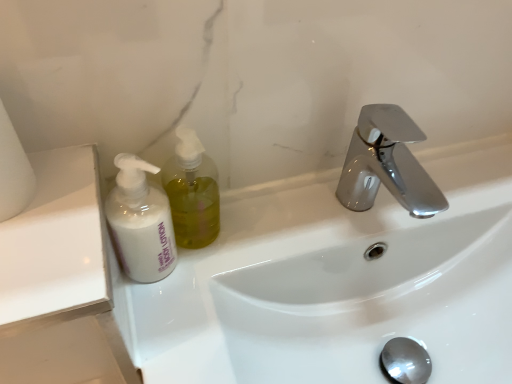
This screenshot has height=384, width=512. What do you see at coordinates (192, 192) in the screenshot?
I see `translucent yellow liquid at left` at bounding box center [192, 192].

I want to click on white matte toilet paper at left, so click(13, 171).

At what (x,y) coordinates should I click in order to perform the action: click on translucent yellow liquid at left. Please return your answer as a coordinate pair (x, y). The height and width of the screenshot is (384, 512). Looking at the image, I should click on (192, 192).

Is white glossy sink at center behind white matte toilet paper at left?

Yes, white glossy sink at center is further from the camera.

Is white glossy sink at center completely or partially outside of white matte toilet paper at left?

white glossy sink at center lies outside white matte toilet paper at left's area.

Are white glossy sink at center and white matte toilet paper at left far apart?

They are positioned close to each other.

From a real-world perspective, who is located lower, white glossy sink at center or white matte toilet paper at left?

In real-world perspective, white glossy sink at center is lower.

Which is in front, point (13, 145) or point (172, 252)?

The point (13, 145) is in front.

Is white matte toilet paper at left inside or outside of white matte lotion at left?

white matte toilet paper at left is spatially situated outside white matte lotion at left.

From the image's perspective, would you say white matte toilet paper at left is positioned over white matte lotion at left?

Yes, from the image's perspective, white matte toilet paper at left is over white matte lotion at left.

The width and height of the screenshot is (512, 384). I want to click on cleaning product on the right of white matte toilet paper at left, so click(141, 221).

Which is behind, point (294, 282) or point (122, 178)?

The point (294, 282) is behind.

Looking at their sizes, would you say white glossy sink at center is wider or thinner than white matte lotion at left?

In the image, white glossy sink at center appears to be wider than white matte lotion at left.

Is white glossy sink at center turned away from white matte lotion at left?

No, white glossy sink at center's orientation is not away from white matte lotion at left.

Between white glossy sink at center and white matte lotion at left, which one is positioned in front?

Positioned in front is white glossy sink at center.

Can you confirm if translucent yellow liquid at left is taller than white matte toilet paper at left?

Correct, translucent yellow liquid at left is much taller as white matte toilet paper at left.

Find the location of `toilet paper that is above the translucent yellow liquid at left (from a real-world perspective)`. toilet paper that is above the translucent yellow liquid at left (from a real-world perspective) is located at coordinates (13, 171).

Can you confirm if translucent yellow liquid at left is bigger than white matte toilet paper at left?

Incorrect, translucent yellow liquid at left is not larger than white matte toilet paper at left.

From a real-world perspective, is translucent yellow liquid at left on top of white matte toilet paper at left?

No, from a real-world perspective, translucent yellow liquid at left is not on top of white matte toilet paper at left.

Is the depth of white matte toilet paper at left greater than that of white glossy sink at center?

No.

In terms of width, does white matte toilet paper at left look wider or thinner when compared to white glossy sink at center?

In the image, white matte toilet paper at left appears to be more narrow than white glossy sink at center.

Who is smaller, white matte toilet paper at left or white glossy sink at center?

With smaller size is white matte toilet paper at left.

From a real-world perspective, is white matte toilet paper at left physically located above or below white glossy sink at center?

In terms of real-world spatial position, white matte toilet paper at left is above white glossy sink at center.

From a real-world perspective, which is physically above, translucent yellow liquid at left or white glossy sink at center?

From a 3D spatial view, translucent yellow liquid at left is above.

Is white glossy sink at center at the back of translucent yellow liquid at left?

translucent yellow liquid at left does not have its back to white glossy sink at center.

Which is more distant, (175, 202) or (333, 176)?

The point (333, 176) is farther.

This screenshot has height=384, width=512. I want to click on sink below the translucent yellow liquid at left (from the image's perspective), so click(340, 279).

Is white matte lotion at left to the left of translucent yellow liquid at left from the viewer's perspective?

Yes, white matte lotion at left is to the left of translucent yellow liquid at left.

Where is `soap dispenser behind the white matte lotion at left`? soap dispenser behind the white matte lotion at left is located at coordinates (192, 192).

How many degrees apart are the facing directions of white matte lotion at left and translucent yellow liquid at left?

2.34 degrees.

Is white matte lotion at left facing towards translucent yellow liquid at left?

No, white matte lotion at left is not aimed at translucent yellow liquid at left.

I want to click on toilet paper that is above the white glossy sink at center (from the image's perspective), so click(x=13, y=171).

This screenshot has width=512, height=384. I want to click on toilet paper on the left of white matte lotion at left, so click(x=13, y=171).

Based on their spatial positions, is white glossy sink at center or white matte toilet paper at left further from white matte lotion at left?

white glossy sink at center lies further to white matte lotion at left than the other object.

From the image, which object appears to be nearer to translucent yellow liquid at left, white glossy sink at center or white matte lotion at left?

white matte lotion at left is closer to translucent yellow liquid at left.

Considering their positions, is white matte toilet paper at left positioned closer to white glossy sink at center than white matte lotion at left?

Based on the image, white matte lotion at left appears to be nearer to white glossy sink at center.

Looking at the image, which one is located further to white glossy sink at center, translucent yellow liquid at left or white matte lotion at left?

The object further to white glossy sink at center is white matte lotion at left.

Looking at this image, looking at the image, which one is located closer to white matte toilet paper at left, white matte lotion at left or white glossy sink at center?

white matte lotion at left is closer to white matte toilet paper at left.

Estimate the real-world distances between objects in this image. Which object is closer to white matte toilet paper at left, white matte lotion at left or translucent yellow liquid at left?

white matte lotion at left is closer to white matte toilet paper at left.

Considering their positions, is translucent yellow liquid at left positioned further to white matte toilet paper at left than white matte lotion at left?

translucent yellow liquid at left is further to white matte toilet paper at left.

Considering their positions, is white matte toilet paper at left positioned further to white matte lotion at left than white glossy sink at center?

Based on the image, white glossy sink at center appears to be further to white matte lotion at left.

The height and width of the screenshot is (384, 512). Identify the location of cleaning product between white matte toilet paper at left and translucent yellow liquid at left. (141, 221).

Where is `soap dispenser between white matte toilet paper at left and white glossy sink at center in the horizontal direction`? The image size is (512, 384). soap dispenser between white matte toilet paper at left and white glossy sink at center in the horizontal direction is located at coordinates (192, 192).

Identify the location of soap dispenser between white matte lotion at left and white glossy sink at center from left to right. (192, 192).

Image resolution: width=512 pixels, height=384 pixels. What are the coordinates of `cleaning product between white matte toilet paper at left and white glossy sink at center in the horizontal direction` in the screenshot? It's located at (141, 221).